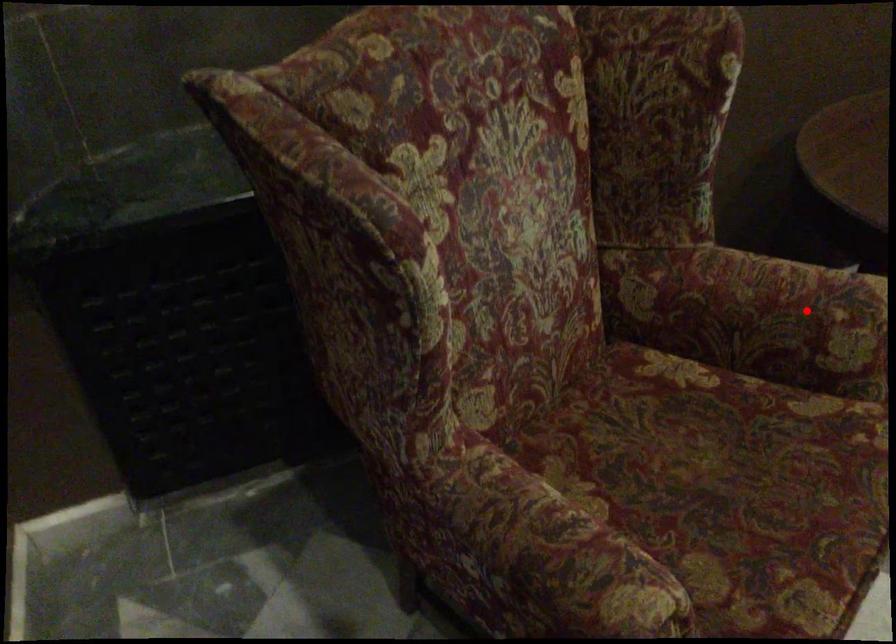
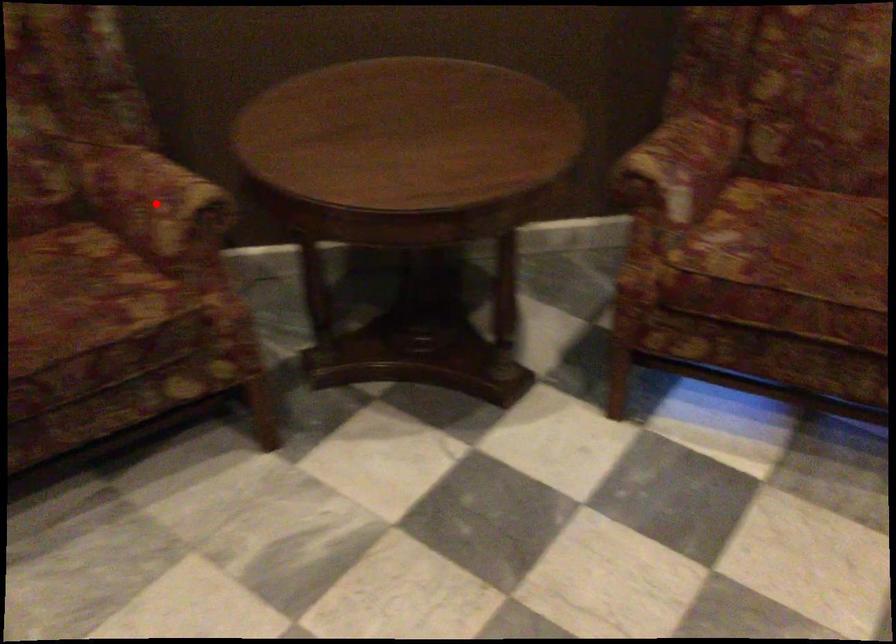
I am providing you with two images of the same scene from different viewpoints. A red point is marked on the first image and another point is marked on the second image. Is the red point in image1 aligned with the point shown in image2?

Yes